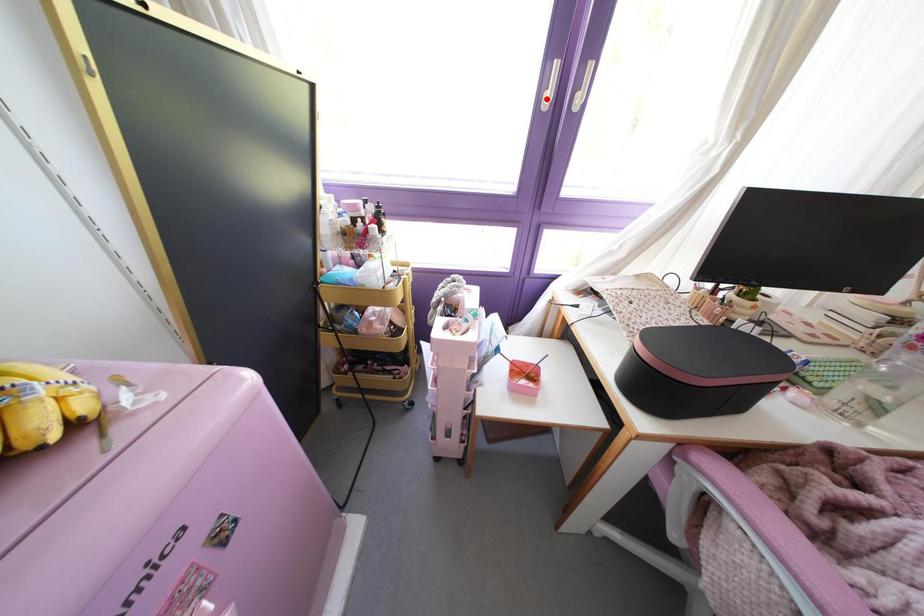
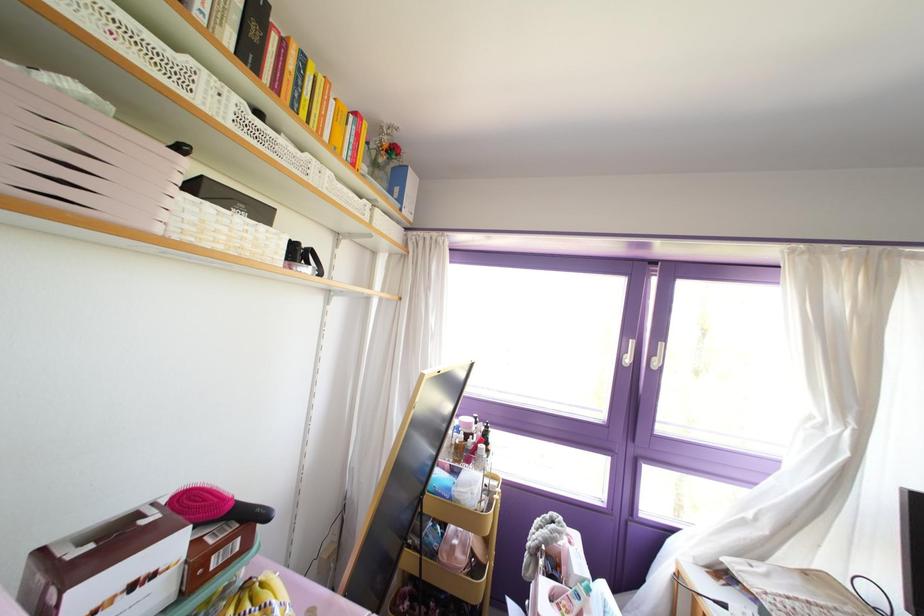
Question: I am providing you with two images of the same scene from different viewpoints. A red point is marked on the first image. At the location where the point appears in image 1, is it still visible in image 2?

Choices:
 (A) Yes
 (B) No

Answer: (A)